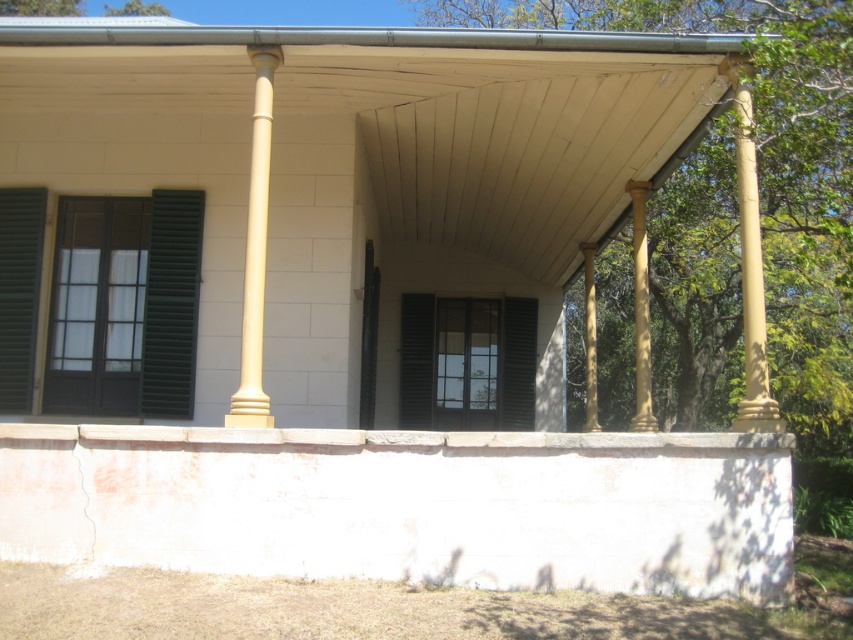
Who is more forward, [511,422] or [758,349]?

Point [758,349]

Is matte black shutter at center further to camera compared to matte gold column at right?

→ That is True.

Identify the location of matte black shutter at center. (467, 362).

Measure the distance from dark green matte shutter at left to green matte shutter at left.

The distance of dark green matte shutter at left from green matte shutter at left is 4.83 feet.

Between dark green matte shutter at left and green matte shutter at left, which one appears on the right side from the viewer's perspective?

dark green matte shutter at left

Does point (157, 314) come behind point (3, 211)?

No, (157, 314) is in front of (3, 211).

The width and height of the screenshot is (853, 640). What are the coordinates of `dark green matte shutter at left` in the screenshot? It's located at (171, 304).

Does matte gold column at right have a lesser width compared to golden polished column at center?

No.

Is point (747, 365) farther from viewer compared to point (640, 369)?

No.

This screenshot has width=853, height=640. What are the coordinates of `matte gold column at right` in the screenshot? It's located at (750, 266).